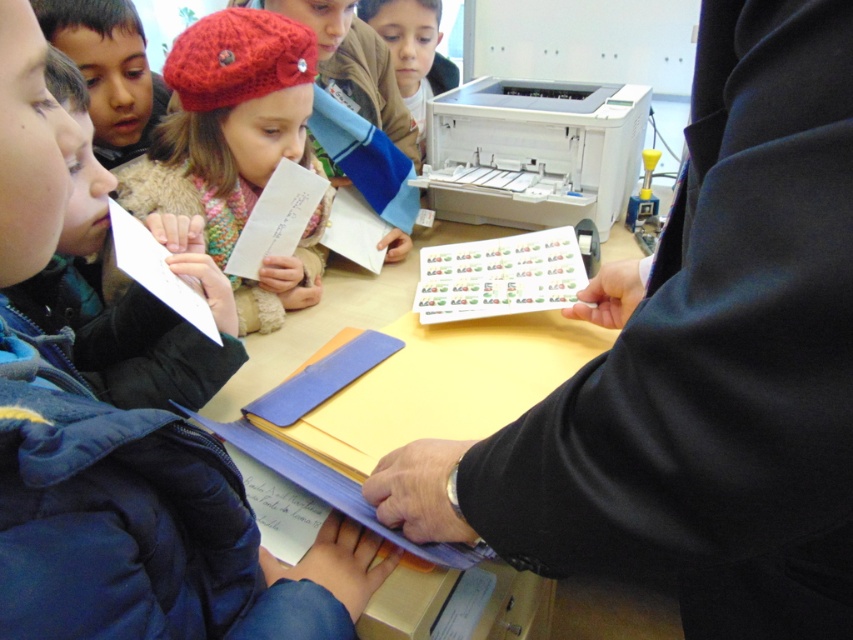
Between point (751, 352) and point (315, 317), which one is positioned in front?

Point (751, 352)

Is point (798, 198) positioned behind point (567, 604)?

That is False.

The image size is (853, 640). What do you see at coordinates (699, 368) in the screenshot? I see `black matte folder at center` at bounding box center [699, 368].

Find the location of a particular element. black matte folder at center is located at coordinates (699, 368).

Who is lower down, matte blue jacket at lower left or white paper at center?

matte blue jacket at lower left is lower down.

Is matte blue jacket at lower left in front of white paper at center?

Yes, matte blue jacket at lower left is in front of white paper at center.

Does point (64, 150) lie behind point (361, 250)?

No, it is not.

The width and height of the screenshot is (853, 640). Find the location of `matte blue jacket at lower left`. matte blue jacket at lower left is located at coordinates (143, 524).

Does black matte folder at center appear on the left side of matte blue jacket at lower left?

No, black matte folder at center is not to the left of matte blue jacket at lower left.

Can you confirm if black matte folder at center is taller than matte blue jacket at lower left?

Yes.

Who is more forward, (834, 528) or (136, 566)?

Positioned in front is point (834, 528).

Where is `black matte folder at center`? The image size is (853, 640). black matte folder at center is located at coordinates (699, 368).